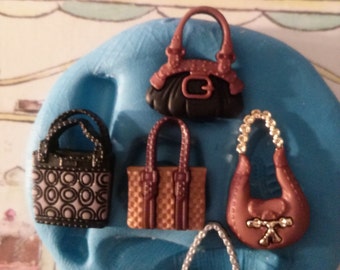
Locate an element on the screen. Image resolution: width=340 pixels, height=270 pixels. festive drawings on toy box is located at coordinates (28, 244), (13, 216), (24, 107), (88, 17).